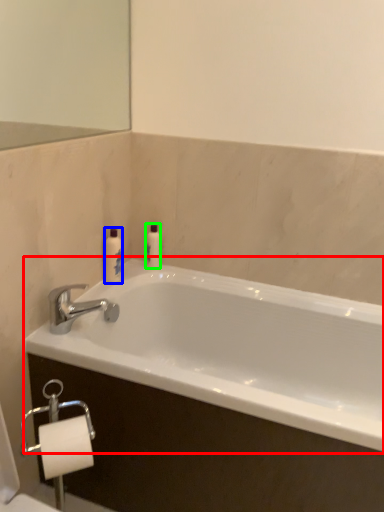
Question: Which object is positioned farthest from bathtub (highlighted by a red box)? Select from toiletry (highlighted by a blue box) and toiletry (highlighted by a green box).

Choices:
 (A) toiletry
 (B) toiletry

Answer: (A)